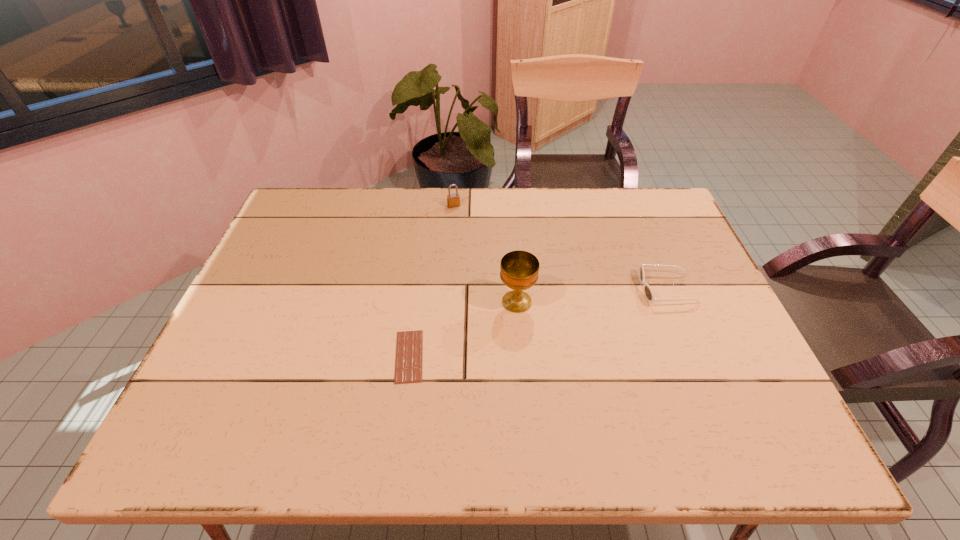
The width and height of the screenshot is (960, 540). I want to click on vacant space positioned 0.290m with the lenses of the rightmost object facing outward, so click(531, 289).

Find the location of a particular element. Image resolution: width=960 pixels, height=540 pixels. vacant area situated with the lenses of the rightmost object facing outward is located at coordinates (519, 289).

Where is `vacant region located with the lenses of the rightmost object facing outward`? The height and width of the screenshot is (540, 960). vacant region located with the lenses of the rightmost object facing outward is located at coordinates (542, 289).

Where is `free spot located on the front of the chocolate bar`? This screenshot has height=540, width=960. free spot located on the front of the chocolate bar is located at coordinates (401, 414).

In order to click on object present at the far edge in this screenshot , I will do `click(453, 200)`.

The height and width of the screenshot is (540, 960). I want to click on object that is at the right edge, so click(648, 292).

This screenshot has width=960, height=540. Find the location of `free space at the far edge`. free space at the far edge is located at coordinates (484, 219).

Where is `vacant region at the near edge of the desktop`? The image size is (960, 540). vacant region at the near edge of the desktop is located at coordinates (544, 446).

Locate an element on the screen. Image resolution: width=960 pixels, height=540 pixels. free space at the left edge is located at coordinates (311, 246).

Where is `vacant space at the right edge of the desktop`? The height and width of the screenshot is (540, 960). vacant space at the right edge of the desktop is located at coordinates (750, 360).